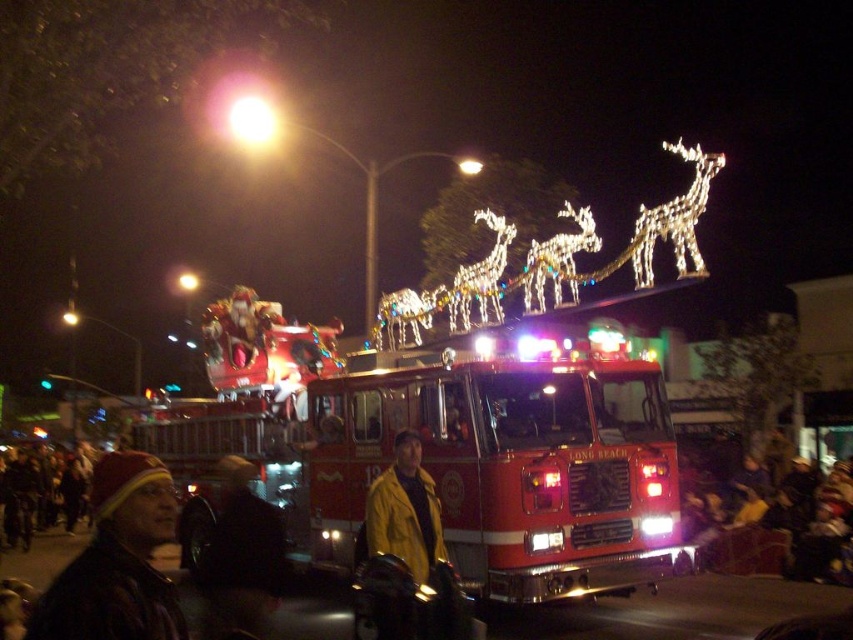
Question: Which object is positioned farthest from the shiny red fire truck at center?

Choices:
 (A) dark brown leather jacket at lower left
 (B) yellow matte jacket at center
 (C) leather jacket at lower left

Answer: (C)

Question: Can you confirm if shiny red fire truck at center is positioned to the right of dark brown leather jacket at lower left?

Choices:
 (A) yes
 (B) no

Answer: (A)

Question: Which object appears closest to the camera in this image?

Choices:
 (A) yellow matte jacket at center
 (B) dark brown leather jacket at lower left

Answer: (A)

Question: From the image, what is the correct spatial relationship of yellow matte jacket at center in relation to dark brown leather jacket at lower left?

Choices:
 (A) right
 (B) left

Answer: (A)

Question: Among these points, which one is nearest to the camera?

Choices:
 (A) (247, 532)
 (B) (451, 426)
 (C) (151, 632)

Answer: (C)

Question: Does shiny red fire truck at center appear on the right side of leather jacket at lower left?

Choices:
 (A) no
 (B) yes

Answer: (B)